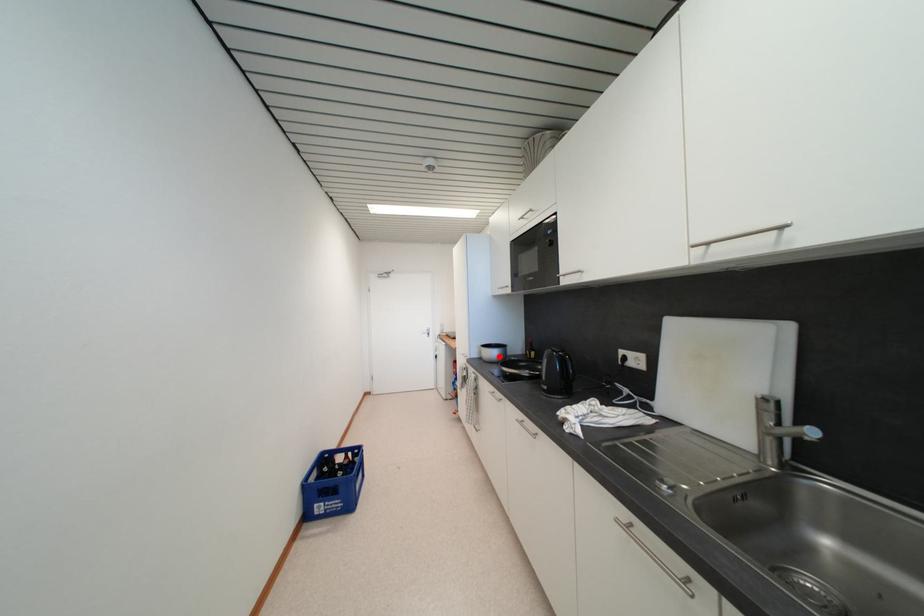
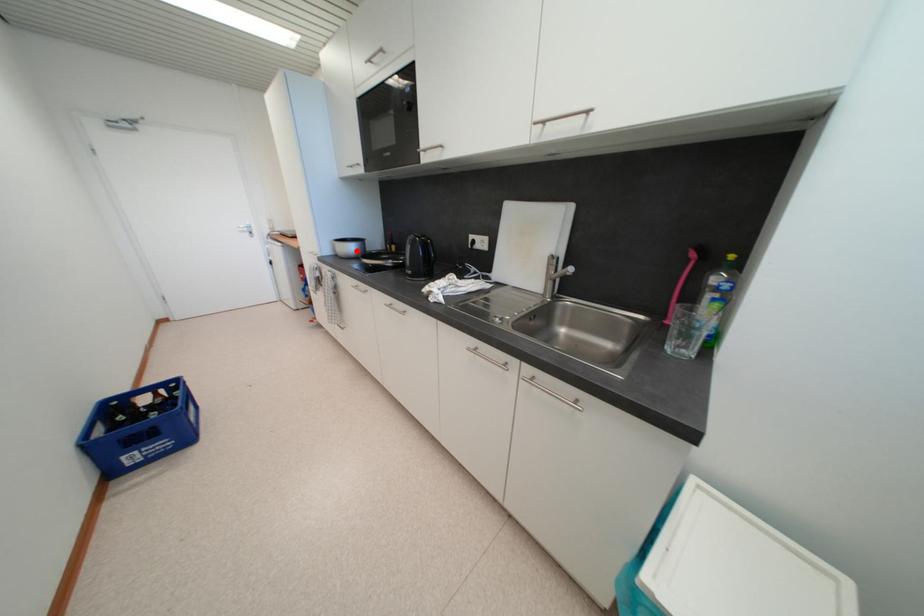
Consider the image. I am providing you with two images of the same scene from different viewpoints. A red point is marked on the first image and another point is marked on the second image. Is the red point in image1 aligned with the point shown in image2?

Yes